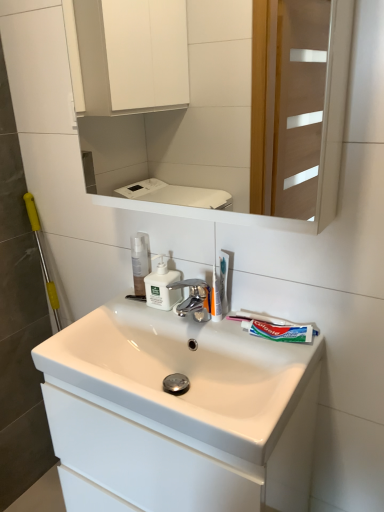
Find the location of a particular element. free space to the left of white matte toothpaste at right is located at coordinates (227, 332).